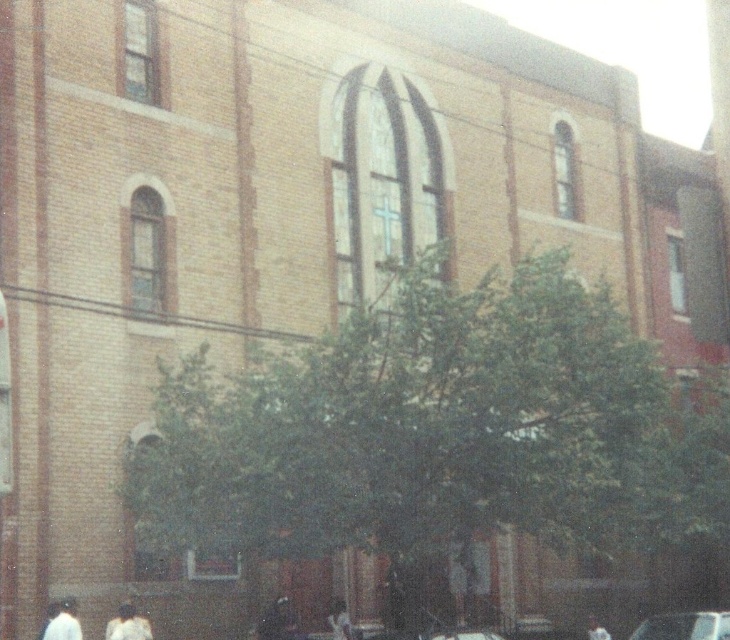
You are standing in front of the brick building and see a white matte shirt at lower left and a white matte person at lower left. Which object is more to the left?

The white matte person at lower left is more to the left because the white matte shirt at lower left is positioned on its right side.

You are standing in front of the brick building and want to take a photo. There are two points marked on the building. Which point is closer to you, point 1 at coordinates [118,628] or point 2 at coordinates [350,627]?

Point 1 at coordinates [118,628] is closer to you than point 2 at coordinates [350,627].